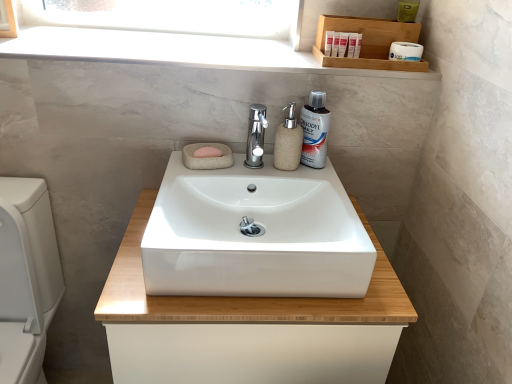
This screenshot has width=512, height=384. What do you see at coordinates (256, 136) in the screenshot?
I see `polished chrome tap at center` at bounding box center [256, 136].

In order to click on white matte toilet paper at upper right in this screenshot , I will do `click(405, 51)`.

This screenshot has height=384, width=512. I want to click on white glossy sink at center, so click(247, 327).

Where is `wooden tray at upper right`? This screenshot has height=384, width=512. wooden tray at upper right is located at coordinates (369, 42).

Identify the location of white plastic tubes at upper right, which is counted as the second toiletry, starting from the right. The width and height of the screenshot is (512, 384). (352, 44).

Measure the distance between beige stone soap dispenser at center and camera.

The distance of beige stone soap dispenser at center from camera is 3.46 feet.

Describe the element at coordinates (26, 277) in the screenshot. The width and height of the screenshot is (512, 384). I see `white glossy toilet at lower left` at that location.

Identify the location of polished chrome tap at center. The image size is (512, 384). (256, 136).

Can white plastic tubes at upper center, placed as the third toiletry when sorted from right to left, be found inside polished chrome tap at center?

Actually, white plastic tubes at upper center, placed as the third toiletry when sorted from right to left, is outside polished chrome tap at center.

From the image's perspective, between polished chrome tap at center and white plastic tubes at upper center, placed as the third toiletry when sorted from right to left, who is located below?

polished chrome tap at center.

Is polished chrome tap at center closer to the viewer compared to white plastic tubes at upper center, placed as the third toiletry when sorted from right to left?

Yes.

Which object is positioned more to the right, polished chrome tap at center or white plastic tubes at upper center, the first toiletry positioned from the left?

white plastic tubes at upper center, the first toiletry positioned from the left, is more to the right.

Which is in front, white plastic tubes at upper right, which is the second toiletry from left to right, or white marble window sill at upper center?

white marble window sill at upper center is in front.

Which of these two, white plastic tubes at upper right, which is the second toiletry from left to right, or white marble window sill at upper center, is smaller?

white plastic tubes at upper right, which is the second toiletry from left to right.

Is white plastic tubes at upper right, which is counted as the second toiletry, starting from the right, positioned with its back to white marble window sill at upper center?

That's not correct — white plastic tubes at upper right, which is counted as the second toiletry, starting from the right, is not looking away from white marble window sill at upper center.

Is white plastic tubes at upper right, which is counted as the second toiletry, starting from the right, spatially inside white marble window sill at upper center, or outside of it?

white plastic tubes at upper right, which is counted as the second toiletry, starting from the right, is outside white marble window sill at upper center.

Which is in front, point (335, 27) or point (265, 229)?

Positioned in front is point (265, 229).

Can we say wooden tray at upper right lies outside white glossy sink at center?

wooden tray at upper right lies outside white glossy sink at center's area.

Which is in front, wooden tray at upper right or white glossy sink at center?

Positioned in front is white glossy sink at center.

Is white glossy sink at center at the back of wooden tray at upper right?

No, white glossy sink at center is not at the back of wooden tray at upper right.

From the picture: From the image's perspective, which is below, white marble window sill at upper center or white glossy toilet at lower left?

From the image's view, white glossy toilet at lower left is below.

Is white marble window sill at upper center in contact with white glossy toilet at lower left?

No, white marble window sill at upper center is not in contact with white glossy toilet at lower left.

Would you say white glossy toilet at lower left is part of white marble window sill at upper center's contents?

Definitely not — white glossy toilet at lower left is not inside white marble window sill at upper center.

From their relative heights in the image, would you say white marble window sill at upper center is taller or shorter than white glossy toilet at lower left?

Clearly, white marble window sill at upper center is shorter compared to white glossy toilet at lower left.

Is beige stone soap dispenser at center surrounding white glossy sink at center?

No, white glossy sink at center is not a part of beige stone soap dispenser at center.

Can you confirm if beige stone soap dispenser at center is shorter than white glossy sink at center?

Correct, beige stone soap dispenser at center is not as tall as white glossy sink at center.

From a real-world perspective, which is physically below, beige stone soap dispenser at center or white glossy sink at center?

From a 3D spatial view, white glossy sink at center is below.

Does point (298, 161) lie in front of point (229, 174)?

No, (298, 161) is behind (229, 174).

From the image's perspective, does pink stone soap at center appear lower than polished chrome tap at center?

Indeed, from the image's perspective, pink stone soap at center is shown beneath polished chrome tap at center.

Is pink stone soap at center spatially inside polished chrome tap at center, or outside of it?

pink stone soap at center exists outside the volume of polished chrome tap at center.

Is pink stone soap at center to the left or to the right of polished chrome tap at center in the image?

Based on their positions, pink stone soap at center is located to the left of polished chrome tap at center.

In terms of size, does pink stone soap at center appear bigger or smaller than polished chrome tap at center?

In the image, pink stone soap at center appears to be smaller than polished chrome tap at center.

Looking at this image, in the image, is beige stone soap dispenser at center positioned in front of or behind polished chrome tap at center?

Clearly, beige stone soap dispenser at center is behind polished chrome tap at center.

Is point (284, 110) behind point (250, 124)?

No.

From the image's perspective, does beige stone soap dispenser at center appear lower than polished chrome tap at center?

Yes.

The width and height of the screenshot is (512, 384). Find the location of `tap on the left of white plastic tubes at upper center, placed as the third toiletry when sorted from right to left`. tap on the left of white plastic tubes at upper center, placed as the third toiletry when sorted from right to left is located at coordinates (256, 136).

Identify the location of the 2nd toiletry to the right of the white marble window sill at upper center, counting from the anchor's position. (352, 44).

Consider the image. When comparing their distances from white matte toilet paper at upper right, does white glossy sink at center or white marble window sill at upper center seem closer?

white marble window sill at upper center.

Considering their positions, is pink stone soap at center positioned further to white plastic tubes at upper right, which is counted as the second toiletry, starting from the right, than white matte toilet paper at upper right?

pink stone soap at center is further to white plastic tubes at upper right, which is counted as the second toiletry, starting from the right.

Looking at the image, which one is located closer to pink stone soap at center, polished chrome tap at center or white marble window sill at upper center?

polished chrome tap at center is closer to pink stone soap at center.

From the image, which object appears to be nearer to white glossy sink at center, white glossy sink at center or wooden tray at upper right?

white glossy sink at center is closer to white glossy sink at center.

Considering their positions, is white marble window sill at upper center positioned further to white glossy toilet at lower left than beige stone soap dispenser at center?

beige stone soap dispenser at center.

Estimate the real-world distances between objects in this image. Which object is closer to white glossy sink at center, wooden tray at upper right or white plastic tubes at upper right, which is the second toiletry from left to right?

wooden tray at upper right lies closer to white glossy sink at center than the other object.

Estimate the real-world distances between objects in this image. Which object is closer to white plastic tubes at upper center, placed as the third toiletry when sorted from right to left, white marble window sill at upper center or white plastic tubes at upper right, which is counted as the third toiletry, starting from the left?

white plastic tubes at upper right, which is counted as the third toiletry, starting from the left, is closer to white plastic tubes at upper center, placed as the third toiletry when sorted from right to left.

Which object lies further to the anchor point white glossy mouthwash at upper right, beige stone soap dispenser at center or white glossy sink at center?

Based on the image, white glossy sink at center appears to be further to white glossy mouthwash at upper right.

The image size is (512, 384). Identify the location of tap that lies between white marble window sill at upper center and white glossy sink at center from top to bottom. (256, 136).

In order to click on soap dispenser located between white glossy sink at center and pink stone soap at center in the depth direction in this screenshot , I will do tap(288, 142).

Identify the location of soap dispenser between white matte toilet paper at upper right and white glossy sink at center in the vertical direction. (288, 142).

Find the location of a particular element. This screenshot has width=512, height=384. toilet paper between white glossy sink at center and white plastic tubes at upper right, which is the first toiletry in right-to-left order, along the z-axis is located at coordinates (405, 51).